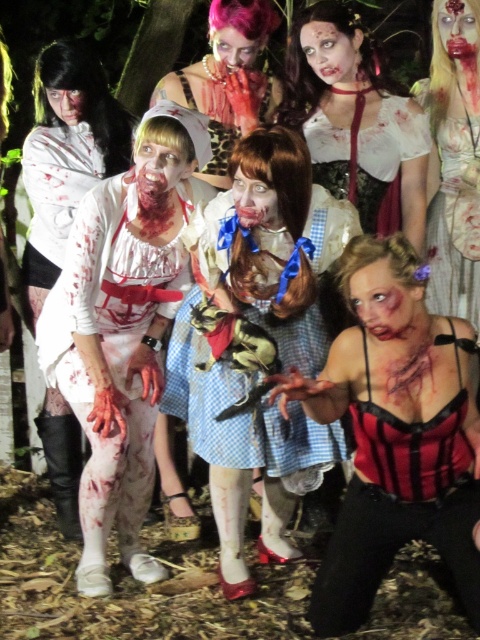
You are a photographer setting up for a group photo at a Halloween party. You need to ensure that the white matte kimono at left and the shiny pink wig at upper center are both visible in the frame. Based on their heights, which object should you adjust the camera angle to focus on first to capture both?

The white matte kimono at left is much taller than the shiny pink wig at upper center, so you should adjust the camera angle to focus on the white matte kimono at left first to ensure both are visible in the frame.

You are standing in the scene and want to move from the point at coordinates point (171,275) to the point at coordinates point (431,113). Which direction should you face to move towards the second point?

To move from point (171,275) to point (431,113), you should face towards the upper left direction since point (431,113) is located above and to the left of point (171,275).

You are a photographer adjusting your camera settings to focus on two specific points in the scene. The first point is at coordinate point(177, 314) and the second is at point(350, 74). Which point should you focus on first if you want to ensure the closest object is in sharp focus?

You should focus on point(177, 314) first because it is closer to the camera than point(350, 74), ensuring the closest object is in sharp focus.